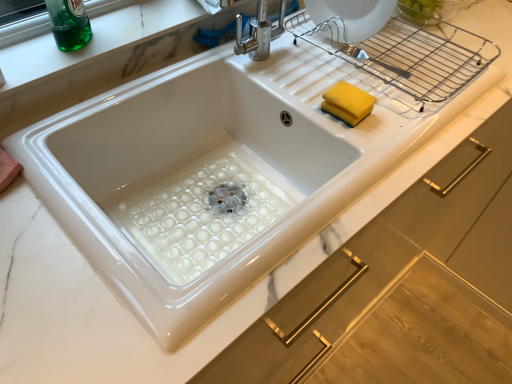
Question: In terms of size, does yellow sponge at upper right appear bigger or smaller than white glossy sink at center?

Choices:
 (A) big
 (B) small

Answer: (B)

Question: In terms of height, does yellow sponge at upper right look taller or shorter compared to white glossy sink at center?

Choices:
 (A) short
 (B) tall

Answer: (A)

Question: Based on their relative distances, which object is farther from the yellow sponge at upper right?

Choices:
 (A) white glossy sink at center
 (B) green glass bottle at upper left

Answer: (B)

Question: Based on their relative distances, which object is farther from the yellow sponge at upper right?

Choices:
 (A) white glossy sink at center
 (B) green glass bottle at upper left

Answer: (B)